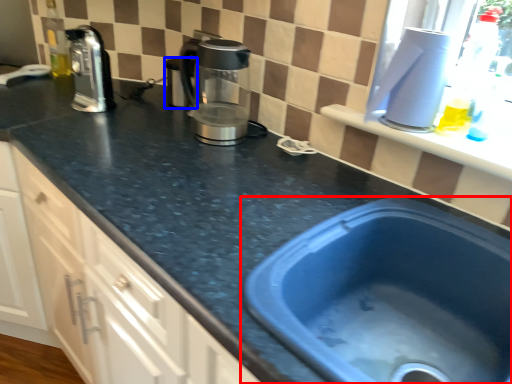
Question: Which point is closer to the camera, sink (highlighted by a red box) or appliance (highlighted by a blue box)?

Choices:
 (A) sink
 (B) appliance

Answer: (A)